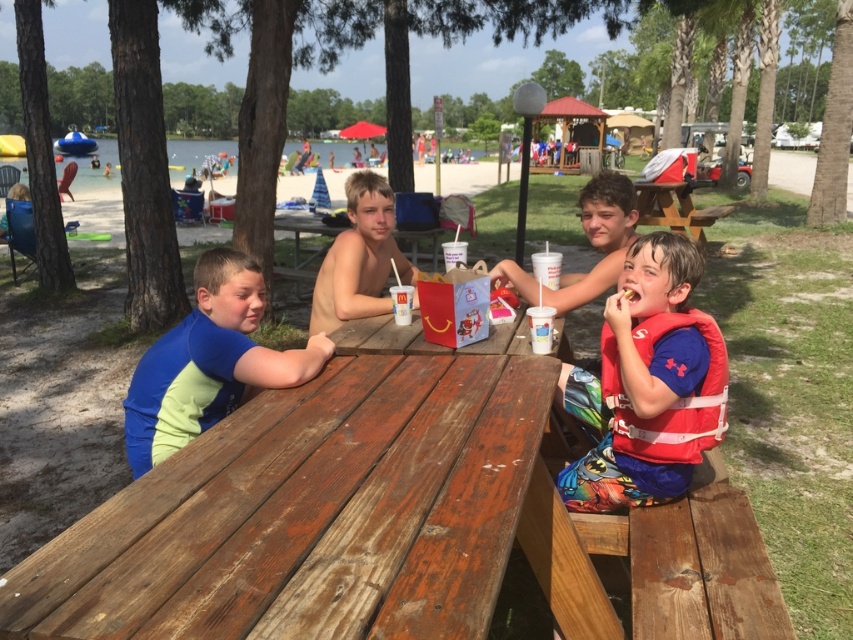
Is weathered wood table at center closer to camera compared to red life vest at right?

Yes, it is in front of red life vest at right.

Is weathered wood table at center to the right of red life vest at right from the viewer's perspective?

Incorrect, weathered wood table at center is not on the right side of red life vest at right.

Is point (404, 502) behind point (717, 380)?

No, it is not.

The height and width of the screenshot is (640, 853). What are the coordinates of `weathered wood table at center` in the screenshot? It's located at (310, 515).

Is blue fabric shirt at left thinner than smooth skin boy at center?

No.

Does blue fabric shirt at left come in front of smooth skin boy at center?

Yes.

At what (x,y) coordinates should I click in order to perform the action: click on blue fabric shirt at left. Please return your answer as a coordinate pair (x, y). The image size is (853, 640). Looking at the image, I should click on (207, 362).

Is point (526, 428) closer to camera compared to point (332, 253)?

Yes, it is in front of point (332, 253).

How far apart are weathered wood table at center and smooth skin boy at center?

They are 4.07 feet apart.

Where is `weathered wood table at center`? weathered wood table at center is located at coordinates (310, 515).